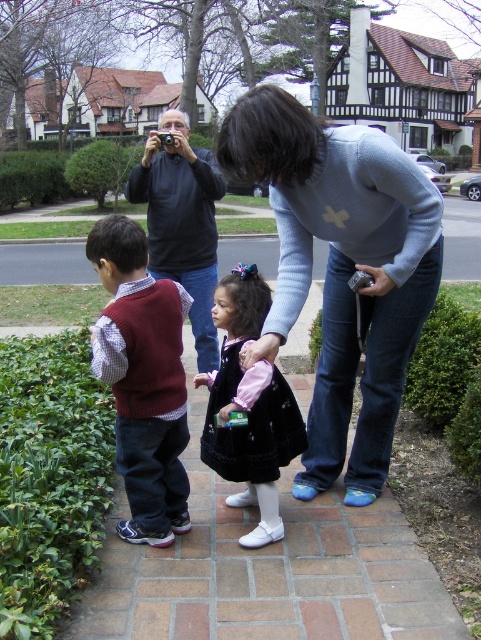
In order to click on light blue sweater at center in this screenshot , I will do `click(341, 269)`.

Does point (260, 353) come farther from viewer compared to point (291, 413)?

No, it is not.

The height and width of the screenshot is (640, 481). What do you see at coordinates (341, 269) in the screenshot?
I see `light blue sweater at center` at bounding box center [341, 269].

Find the location of a particular element. This screenshot has width=481, height=640. light blue sweater at center is located at coordinates (341, 269).

Is light blue sweater at center bigger than dark gray sweater at upper left?

No.

This screenshot has height=640, width=481. Identify the location of light blue sweater at center. (341, 269).

What do you see at coordinates (142, 380) in the screenshot? I see `maroon sweater at left` at bounding box center [142, 380].

Does maroon sweater at left lie behind dark blue velvet dress at center?

No, maroon sweater at left is in front of dark blue velvet dress at center.

Is point (164, 484) closer to viewer compared to point (228, 374)?

No.

The height and width of the screenshot is (640, 481). I want to click on maroon sweater at left, so click(142, 380).